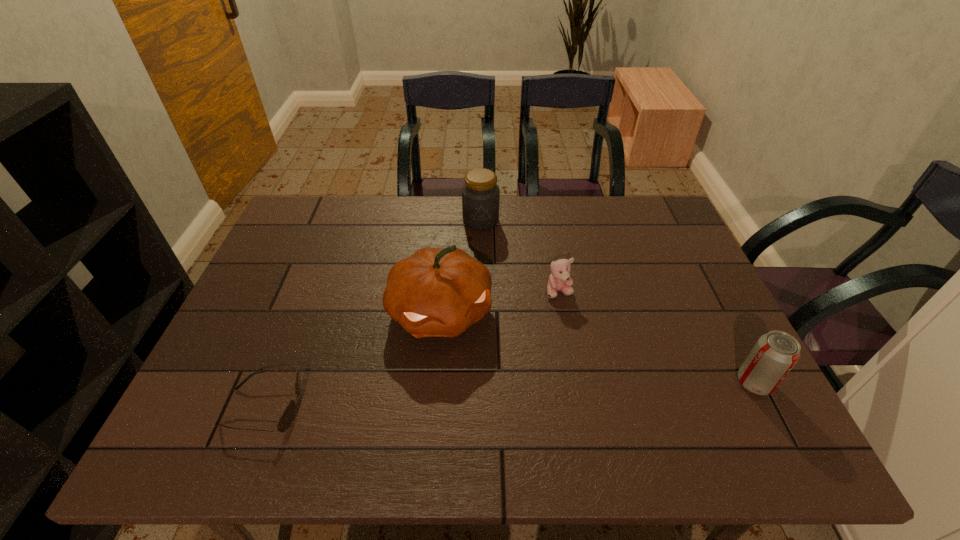
Identify the location of free space on the desktop that is between the shortest object and the soda can and is positioned on the front face of the pumpkin. Image resolution: width=960 pixels, height=540 pixels. (479, 396).

Identify the location of vacant space on the desktop that is between the leftmost object and the soda can and is positioned on the surface of the jar near the warning symbol. This screenshot has width=960, height=540. (468, 397).

Where is `vacant spot on the desktop that is between the sunglasses and the third tallest object and is positioned at the face of the fourth tallest object`? vacant spot on the desktop that is between the sunglasses and the third tallest object and is positioned at the face of the fourth tallest object is located at coordinates (569, 392).